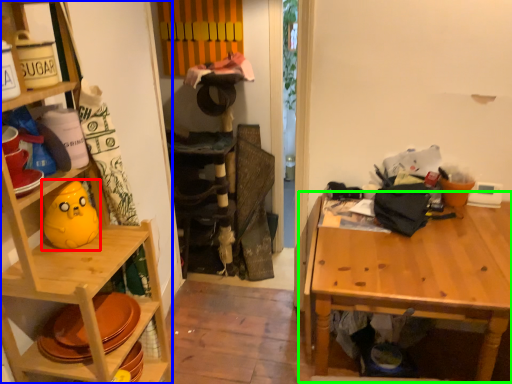
Question: Considering the real-world distances, which object is farthest from toy (highlighted by a red box)? shelf (highlighted by a blue box) or table (highlighted by a green box)?

Choices:
 (A) shelf
 (B) table

Answer: (B)